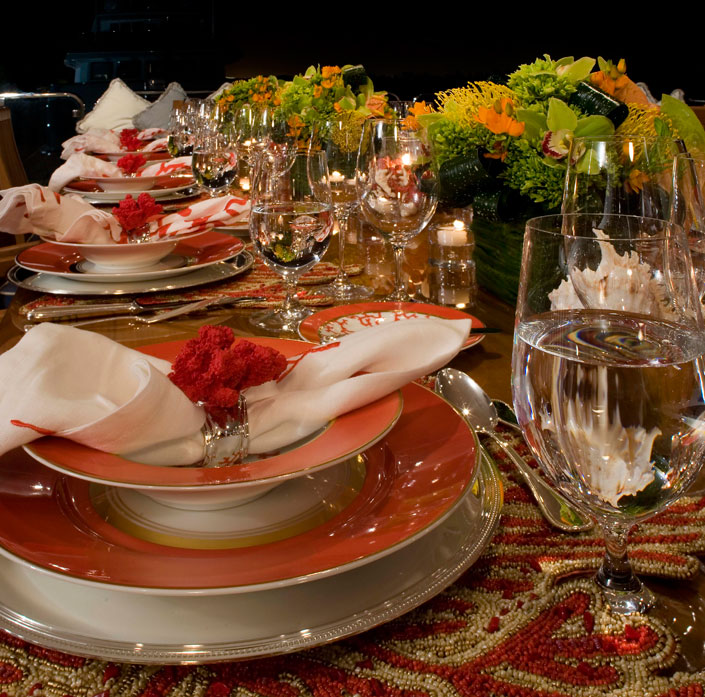
Locate an element on the screen. This screenshot has width=705, height=697. decorative dishes is located at coordinates (132, 571), (158, 631), (271, 472), (42, 260), (70, 289), (110, 252), (125, 181), (111, 196), (118, 153), (374, 311).